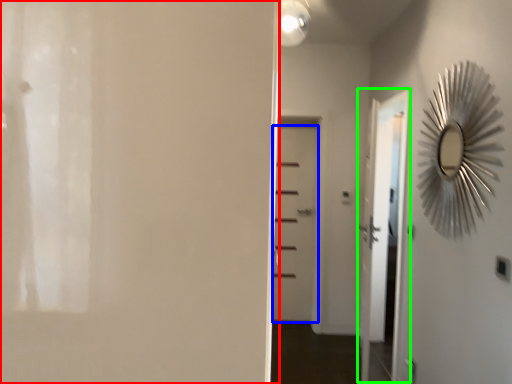
Question: Which is farther away from door (highlighted by a red box)? door (highlighted by a blue box) or screen door (highlighted by a green box)?

Choices:
 (A) door
 (B) screen door

Answer: (A)